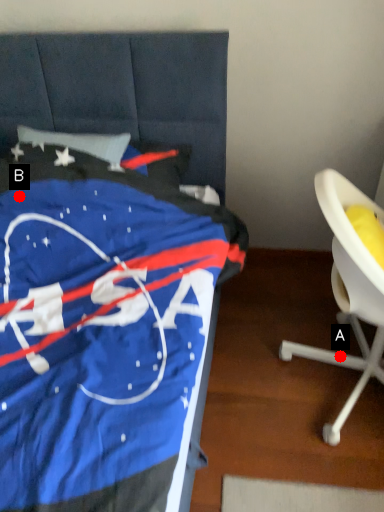
Question: Two points are circled on the image, labeled by A and B beside each circle. Which point is closer to the camera?

Choices:
 (A) A is closer
 (B) B is closer

Answer: (B)